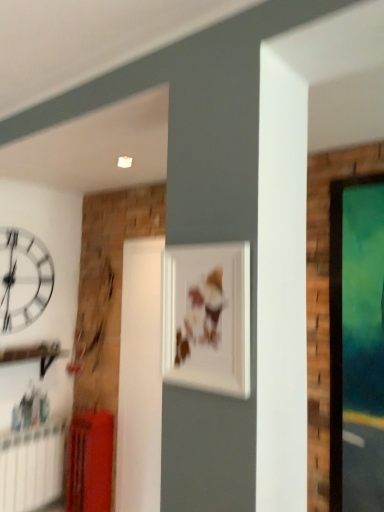
Question: From a real-world perspective, is white plastic radiator at lower left on matte white picture frame at center?

Choices:
 (A) yes
 (B) no

Answer: (B)

Question: From the image's perspective, is white plastic radiator at lower left located above matte white picture frame at center?

Choices:
 (A) yes
 (B) no

Answer: (B)

Question: Can you see white plastic radiator at lower left touching matte white picture frame at center?

Choices:
 (A) yes
 (B) no

Answer: (B)

Question: Can you confirm if white plastic radiator at lower left is thinner than matte white picture frame at center?

Choices:
 (A) no
 (B) yes

Answer: (A)

Question: Is white plastic radiator at lower left at the right side of matte white picture frame at center?

Choices:
 (A) yes
 (B) no

Answer: (B)

Question: Considering the positions of white plastic radiator at lower left and white glossy clock at upper left in the image, is white plastic radiator at lower left bigger or smaller than white glossy clock at upper left?

Choices:
 (A) small
 (B) big

Answer: (B)

Question: Looking at their shapes, would you say white plastic radiator at lower left is wider or thinner than white glossy clock at upper left?

Choices:
 (A) thin
 (B) wide

Answer: (B)

Question: Considering the positions of point (0, 438) and point (1, 268), is point (0, 438) closer or farther from the camera than point (1, 268)?

Choices:
 (A) closer
 (B) farther

Answer: (A)

Question: Is white plastic radiator at lower left to the left or to the right of white glossy clock at upper left in the image?

Choices:
 (A) left
 (B) right

Answer: (B)

Question: Does point (192, 378) appear closer or farther from the camera than point (11, 506)?

Choices:
 (A) closer
 (B) farther

Answer: (A)

Question: Is matte white picture frame at center wider or thinner than white plastic radiator at lower left?

Choices:
 (A) wide
 (B) thin

Answer: (B)

Question: From a real-world perspective, is matte white picture frame at center positioned above or below white plastic radiator at lower left?

Choices:
 (A) below
 (B) above

Answer: (B)

Question: From their relative heights in the image, would you say matte white picture frame at center is taller or shorter than white plastic radiator at lower left?

Choices:
 (A) short
 (B) tall

Answer: (A)

Question: From their relative heights in the image, would you say white glossy clock at upper left is taller or shorter than matte white picture frame at center?

Choices:
 (A) short
 (B) tall

Answer: (B)

Question: Considering the positions of white glossy clock at upper left and matte white picture frame at center in the image, is white glossy clock at upper left bigger or smaller than matte white picture frame at center?

Choices:
 (A) small
 (B) big

Answer: (B)